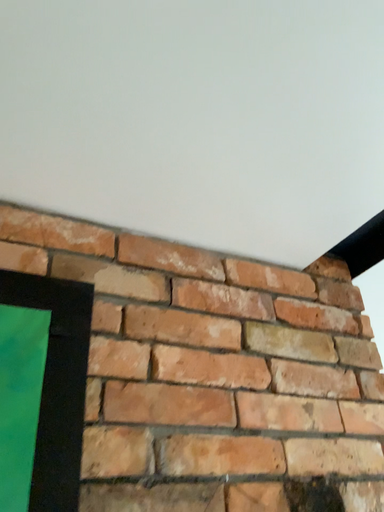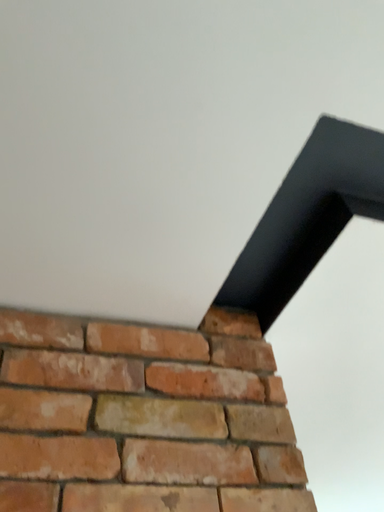
Question: How did the camera likely rotate when shooting the video?

Choices:
 (A) rotated upward
 (B) rotated downward

Answer: (A)